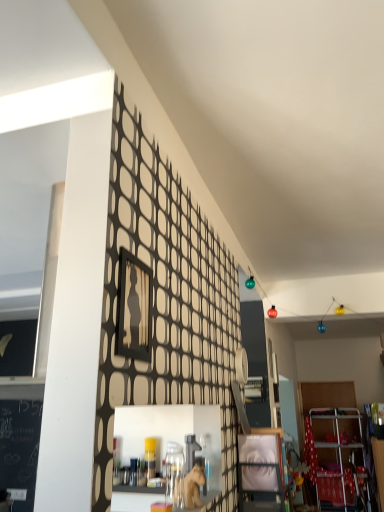
Question: Is wooden picture frame at center wider or thinner than matte wooden frame at center?

Choices:
 (A) thin
 (B) wide

Answer: (A)

Question: Is wooden picture frame at center spatially inside matte wooden frame at center, or outside of it?

Choices:
 (A) outside
 (B) inside

Answer: (A)

Question: From the image's perspective, is wooden picture frame at center above or below matte wooden frame at center?

Choices:
 (A) above
 (B) below

Answer: (A)

Question: In terms of size, does matte wooden frame at center appear bigger or smaller than wooden picture frame at center?

Choices:
 (A) small
 (B) big

Answer: (B)

Question: Is matte wooden frame at center to the left or to the right of wooden picture frame at center in the image?

Choices:
 (A) left
 (B) right

Answer: (B)

Question: From a real-world perspective, relative to wooden picture frame at center, is matte wooden frame at center vertically above or below?

Choices:
 (A) below
 (B) above

Answer: (A)

Question: Is matte wooden frame at center wider or thinner than wooden picture frame at center?

Choices:
 (A) thin
 (B) wide

Answer: (B)